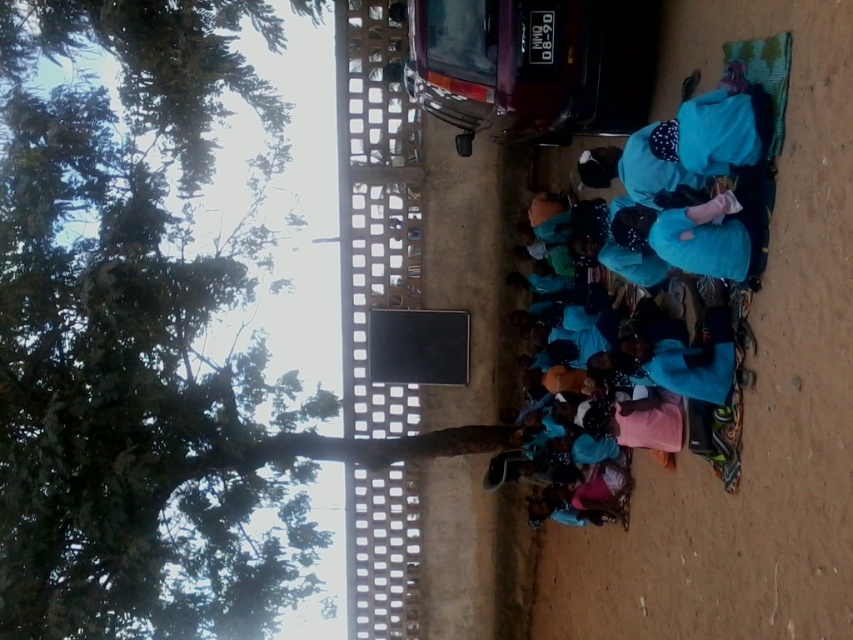
Between point (44, 461) and point (653, 220), which one is positioned in front?

Positioned in front is point (653, 220).

Can you confirm if green leafy tree at upper left is positioned below blue fabric at center?

Yes.

You are a GUI agent. You are given a task and a screenshot of the screen. Output one action in this format:
    pyautogui.click(x=<x>, y=<y>)
    Task: Click on the green leafy tree at upper left
    
    Given the screenshot: What is the action you would take?
    pyautogui.click(x=138, y=337)

I want to click on green leafy tree at upper left, so click(x=138, y=337).